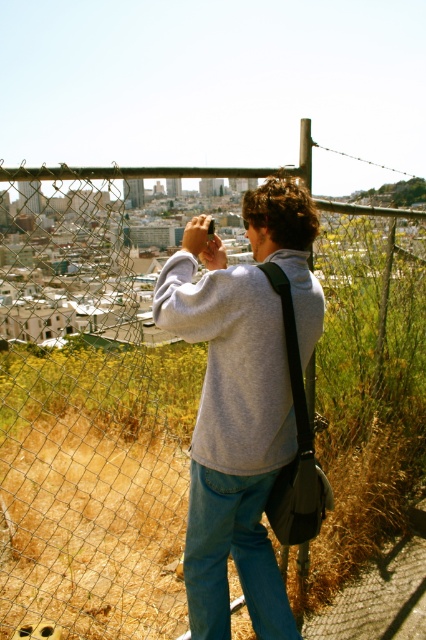
You are a photographer setting up a shot and notice two items in the scene. The gray cotton sweatshirt at center and the denim at left. Which item is closer to the left side of the image?

The denim at left is closer to the left side of the image because the gray cotton sweatshirt at center is positioned on the left side of it.

You are a photographer standing in the scene. You want to adjust your position so that the gray cotton sweatshirt at center and the denim at left are closer together in the photo. Based on their current distance, is this adjustment feasible? Please explain.

The gray cotton sweatshirt at center is 14.13 inches away from the denim at left. Since this distance is relatively short, adjusting your position slightly could make them appear closer together in the photo.